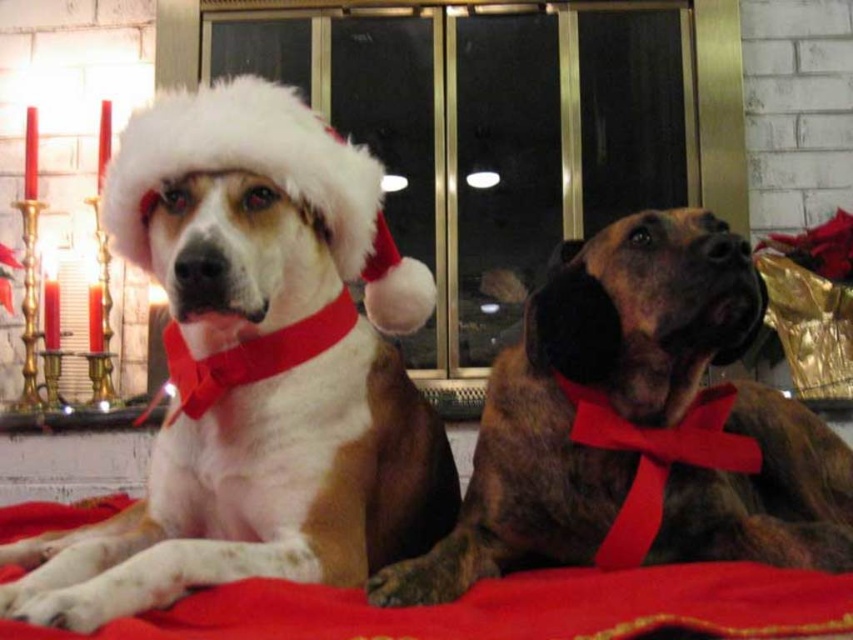
Can you confirm if white fur dog at center is taller than red fabric blanket at lower center?

Yes, white fur dog at center is taller than red fabric blanket at lower center.

Does point (409, 449) lie in front of point (218, 602)?

No, it is not.

The width and height of the screenshot is (853, 640). Describe the element at coordinates (257, 368) in the screenshot. I see `white fur dog at center` at that location.

The image size is (853, 640). Identify the location of white fur dog at center. (257, 368).

Does point (378, 522) come farther from viewer compared to point (839, 563)?

Yes, point (378, 522) is farther from viewer.

Can you confirm if white fur dog at center is positioned below braun leather dog at center?

No.

Is point (296, 337) closer to camera compared to point (705, 362)?

Yes.

Where is `white fur dog at center`? white fur dog at center is located at coordinates (257, 368).

Does red fabric blanket at lower center appear under white fluffy santa hat at upper left?

Indeed, red fabric blanket at lower center is positioned under white fluffy santa hat at upper left.

Who is shorter, red fabric blanket at lower center or white fluffy santa hat at upper left?

red fabric blanket at lower center

Which is in front, point (296, 634) or point (317, 140)?

Positioned in front is point (296, 634).

Identify the location of red fabric blanket at lower center. The image size is (853, 640). (508, 609).